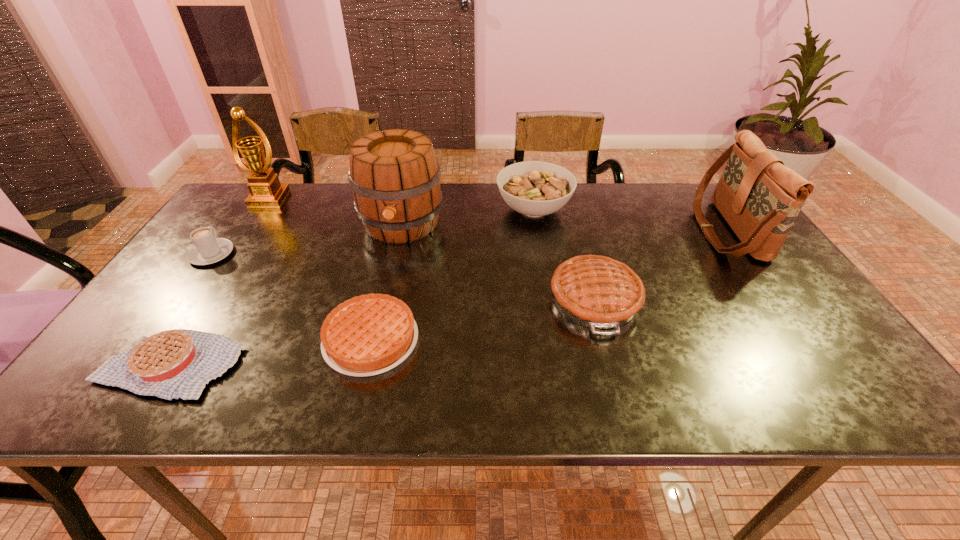
Where is `vacant region between the stew and the cider`? The height and width of the screenshot is (540, 960). vacant region between the stew and the cider is located at coordinates (468, 217).

The height and width of the screenshot is (540, 960). I want to click on empty space between the second pie from right to left and the cider, so click(x=386, y=282).

Where is `free space between the leftmost pie and the rightmost object`? This screenshot has height=540, width=960. free space between the leftmost pie and the rightmost object is located at coordinates (447, 298).

Locate an element on the screen. The width and height of the screenshot is (960, 540). vacant area that lies between the leftmost pie and the stew is located at coordinates (351, 287).

You are a GUI agent. You are given a task and a screenshot of the screen. Output one action in this format:
    pyautogui.click(x=<x>, y=<y>)
    Task: Click on the fourth closest object to the award
    This screenshot has height=540, width=960.
    Given the screenshot: What is the action you would take?
    pyautogui.click(x=177, y=363)

Identify the location of object that can be found as the sixth closest to the cider. (177, 363).

Choose which pie is the nearest neighbor to the sixth tallest object. Please provide its 2D coordinates. Your answer should be formatted as a tuple, i.e. [(x, y)], where the tuple contains the x and y coordinates of a point satisfying the conditions above.

[(177, 363)]

Image resolution: width=960 pixels, height=540 pixels. What are the coordinates of `pie object that ranks as the closest to the shoulder bag` in the screenshot? It's located at (598, 292).

Locate an element on the screen. Image resolution: width=960 pixels, height=540 pixels. free space that satisfies the following two spatial constraints: 1. on the front-facing side of the leftmost pie; 2. on the right side of the tallest object is located at coordinates (159, 364).

Locate an element on the screen. free space that satisfies the following two spatial constraints: 1. on the side of the rightmost pie where the spigot is located; 2. on the left side of the cider is located at coordinates (384, 300).